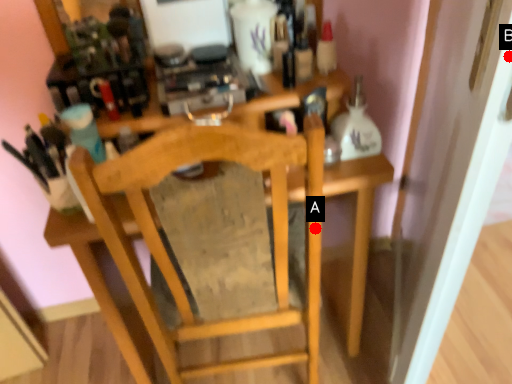
Question: Two points are circled on the image, labeled by A and B beside each circle. Among these points, which one is farthest from the camera?

Choices:
 (A) A is further
 (B) B is further

Answer: (A)